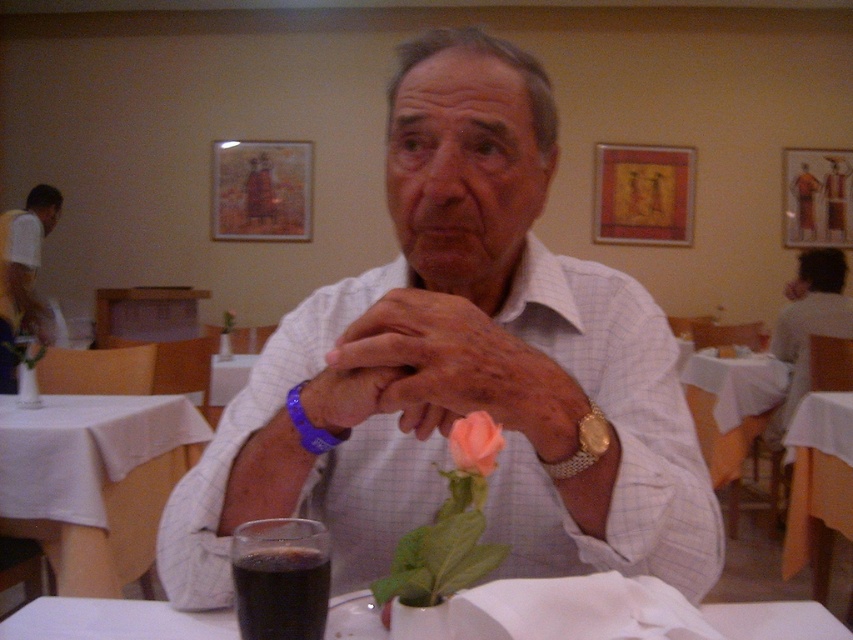
Does point (242, 634) come farther from viewer compared to point (802, 353)?

No, it is in front of (802, 353).

Can you confirm if dark liquid glass at center is bigger than matte white shirt at center?

No.

At what (x,y) coordinates should I click in order to perform the action: click on dark liquid glass at center. Please return your answer as a coordinate pair (x, y). Image resolution: width=853 pixels, height=640 pixels. Looking at the image, I should click on (281, 593).

Does leather wristwatch at center appear on the left side of white fabric shirt at left?

No, leather wristwatch at center is not to the left of white fabric shirt at left.

Does leather wristwatch at center appear over white fabric shirt at left?

No.

The height and width of the screenshot is (640, 853). What do you see at coordinates (451, 371) in the screenshot?
I see `leather wristwatch at center` at bounding box center [451, 371].

Locate an element on the screen. Image resolution: width=853 pixels, height=640 pixels. leather wristwatch at center is located at coordinates (451, 371).

Is white checkered shirt at center bigger than white glossy table at lower center?

Indeed, white checkered shirt at center has a larger size compared to white glossy table at lower center.

Which is in front, point (465, 308) or point (788, 616)?

Positioned in front is point (465, 308).

Where is `white checkered shirt at center`? This screenshot has width=853, height=640. white checkered shirt at center is located at coordinates (460, 368).

You are a GUI agent. You are given a task and a screenshot of the screen. Output one action in this format:
    pyautogui.click(x=<x>, y=<y>)
    Task: Click on the white checkered shirt at center
    
    Given the screenshot: What is the action you would take?
    pyautogui.click(x=460, y=368)